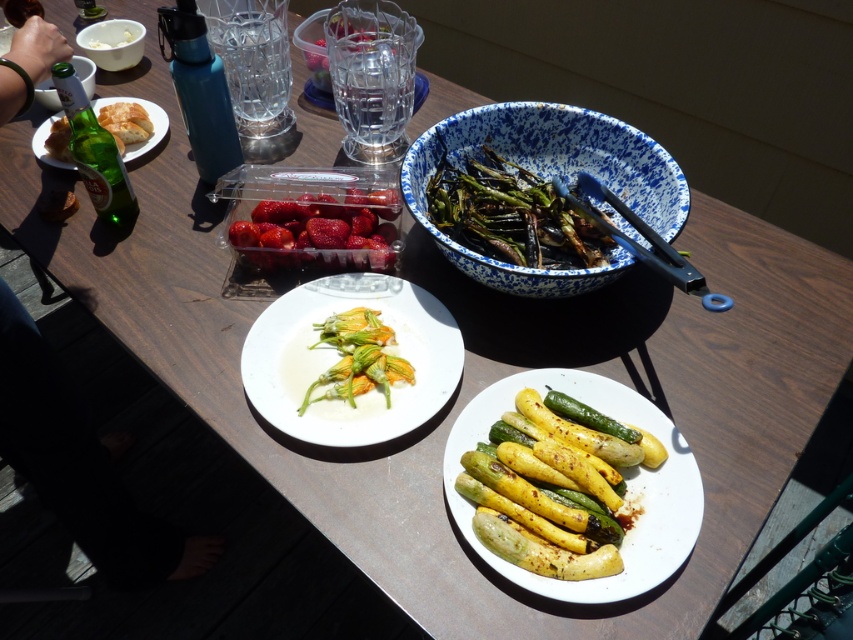
You are taking a photo of the dining setup and want to focus on the two points labeled as point (48, 88) and point (107, 44). Which point should you focus on first to ensure both are in sharp focus?

Point (48, 88) is closer to the camera than point (107, 44). To ensure both are in sharp focus, focus on the closer point first, which is point (48, 88).

You are setting up a picnic and need to place a 12cm wide bottle between the white matte plate at center and the white ceramic bowl at upper left. Considering their widths, will the bottle fit between them?

The white matte plate at center is wider than the white ceramic bowl at upper left. Since the bottle is 12cm wide, it depends on the available space between them. However, the description only mentions their widths, not the distance between them. Without knowing the distance, we can only confirm their relative sizes but cannot determine if the bottle will fit.

You are setting up a picnic and want to place a 4.5 inch wide bottle between the blue speckled bowl at upper center and the white matte bowl at upper center. Will the bottle fit between them?

The blue speckled bowl at upper center and white matte bowl at upper center are 4.29 inches apart. Since the bottle is 4.5 inches wide, it won existing space between them.